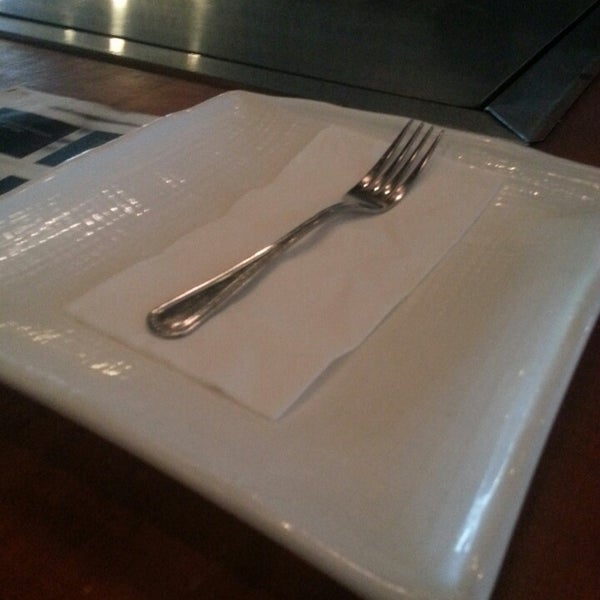
Where is `wooden table behind plate`? The height and width of the screenshot is (600, 600). wooden table behind plate is located at coordinates (575, 134).